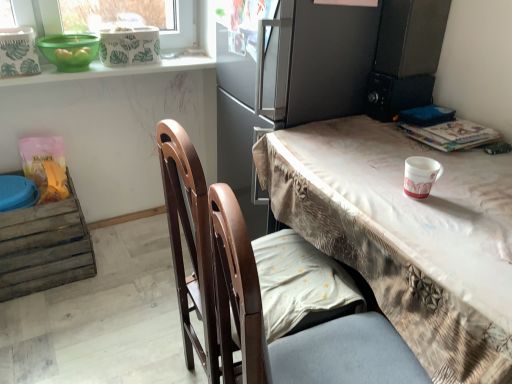
You are a GUI agent. You are given a task and a screenshot of the screen. Output one action in this format:
    pyautogui.click(x=<x>, y=<y>)
    Task: Click on the free space to the left of white paper cup at right
    This screenshot has height=384, width=512.
    Given the screenshot: What is the action you would take?
    pyautogui.click(x=366, y=191)